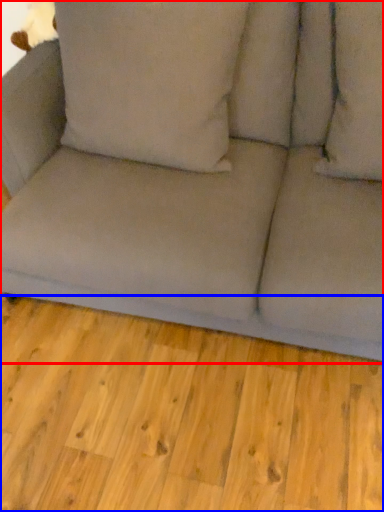
Question: Which of the following is the closest to the observer, studio couch (highlighted by a red box) or plank (highlighted by a blue box)?

Choices:
 (A) studio couch
 (B) plank

Answer: (A)